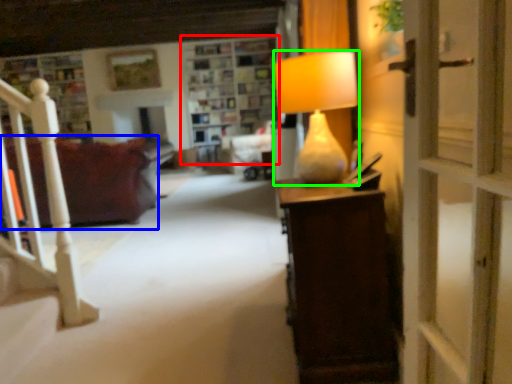
Question: Estimate the real-world distances between objects in this image. Which object is farther from shelf (highlighted by a red box), studio couch (highlighted by a blue box) or lamp (highlighted by a green box)?

Choices:
 (A) studio couch
 (B) lamp

Answer: (B)